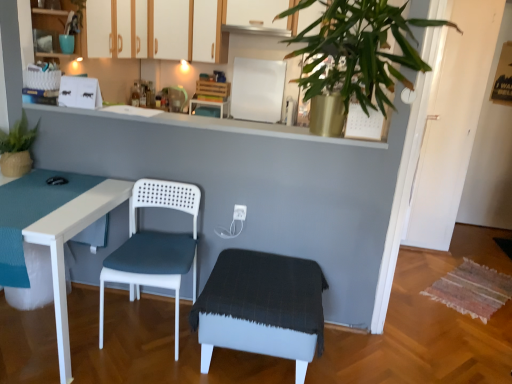
Question: Should I look upward or downward to see white plastic electric outlet at center?

Choices:
 (A) up
 (B) down

Answer: (B)

Question: Considering the relative sizes of white fabric step stool at center and white wood cabinets at upper center, which ranks as the second cabinetry in back-to-front order, in the image provided, is white fabric step stool at center wider than white wood cabinets at upper center, which ranks as the second cabinetry in back-to-front order,?

Choices:
 (A) yes
 (B) no

Answer: (A)

Question: Is the position of white fabric step stool at center more distant than that of white wood cabinets at upper center, which ranks as the second cabinetry in back-to-front order?

Choices:
 (A) no
 (B) yes

Answer: (A)

Question: Considering the relative sizes of white fabric step stool at center and white wood cabinets at upper center, the second cabinetry viewed from the right, in the image provided, is white fabric step stool at center taller than white wood cabinets at upper center, the second cabinetry viewed from the right,?

Choices:
 (A) yes
 (B) no

Answer: (B)

Question: From the image's perspective, is white fabric step stool at center above white wood cabinets at upper center, the second cabinetry positioned from the front?

Choices:
 (A) yes
 (B) no

Answer: (B)

Question: Considering the relative sizes of white fabric step stool at center and white wood cabinets at upper center, which ranks as the second cabinetry in back-to-front order, in the image provided, is white fabric step stool at center shorter than white wood cabinets at upper center, which ranks as the second cabinetry in back-to-front order,?

Choices:
 (A) no
 (B) yes

Answer: (B)

Question: Is white fabric step stool at center positioned with its back to white wood cabinets at upper center, the second cabinetry positioned from the front?

Choices:
 (A) yes
 (B) no

Answer: (B)

Question: From the image's perspective, is gold metallic pot at upper center over white wood cabinets at upper center, the second cabinetry positioned from the front?

Choices:
 (A) no
 (B) yes

Answer: (A)

Question: Does gold metallic pot at upper center turn towards white wood cabinets at upper center, which ranks as the second cabinetry in back-to-front order?

Choices:
 (A) yes
 (B) no

Answer: (B)

Question: Is gold metallic pot at upper center outside white wood cabinets at upper center, marked as the second cabinetry in a left-to-right arrangement?

Choices:
 (A) no
 (B) yes

Answer: (B)

Question: Can you confirm if gold metallic pot at upper center is positioned to the right of white wood cabinets at upper center, marked as the second cabinetry in a left-to-right arrangement?

Choices:
 (A) yes
 (B) no

Answer: (A)

Question: Considering the relative sizes of gold metallic pot at upper center and white wood cabinets at upper center, marked as the second cabinetry in a left-to-right arrangement, in the image provided, is gold metallic pot at upper center wider than white wood cabinets at upper center, marked as the second cabinetry in a left-to-right arrangement,?

Choices:
 (A) yes
 (B) no

Answer: (A)

Question: Would you say gold metallic pot at upper center contains white wood cabinets at upper center, which ranks as the second cabinetry in back-to-front order?

Choices:
 (A) yes
 (B) no

Answer: (B)

Question: From a real-world perspective, is white plastic electric outlet at center positioned under white fabric step stool at center based on gravity?

Choices:
 (A) no
 (B) yes

Answer: (A)